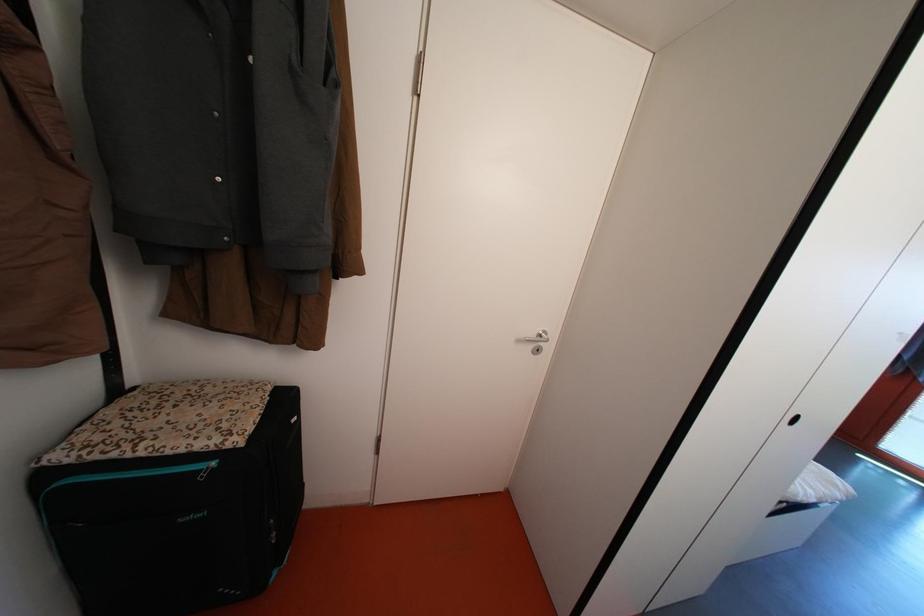
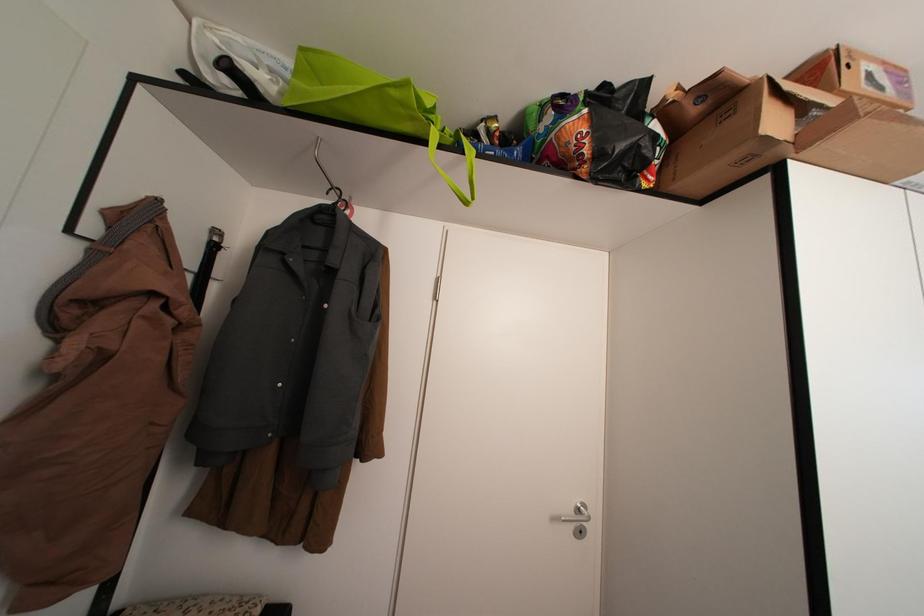
Question: The images are taken continuously from a first-person perspective. In which direction are you moving?

Choices:
 (A) Left
 (B) Right
 (C) Forward
 (D) Backward

Answer: (D)